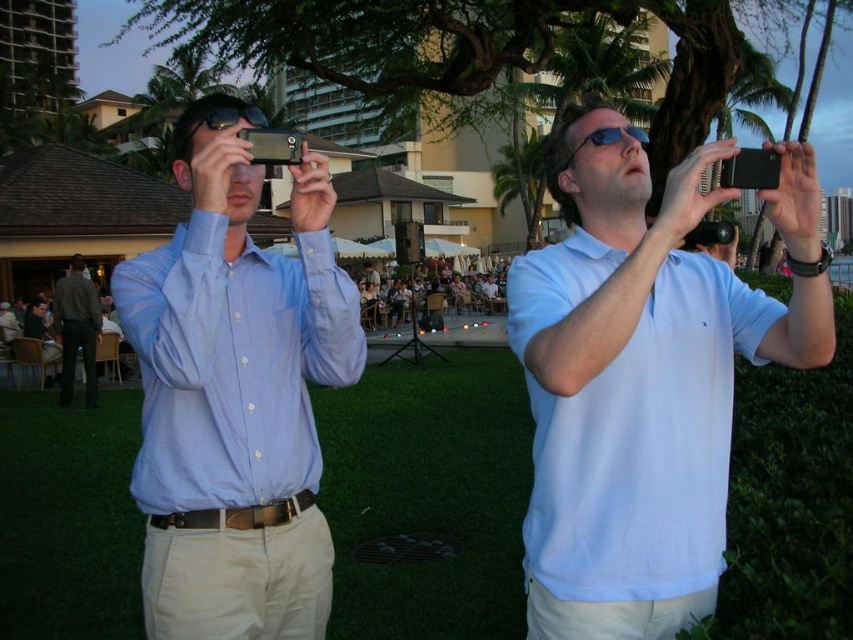
Is point (196, 440) positioned after point (61, 342)?

That is False.

Who is higher up, light blue button-down shirt at left or dark gray textured shirt at left?

light blue button-down shirt at left is higher up.

Is point (248, 365) farther from viewer compared to point (71, 307)?

That is False.

This screenshot has width=853, height=640. Find the location of `light blue button-down shirt at left`. light blue button-down shirt at left is located at coordinates (231, 364).

Which is below, light blue cotton polo shirt at upper right or light blue button-down shirt at left?

light blue cotton polo shirt at upper right is lower down.

Describe the element at coordinates (645, 445) in the screenshot. Image resolution: width=853 pixels, height=640 pixels. I see `light blue cotton polo shirt at upper right` at that location.

Which is behind, point (595, 412) or point (277, 400)?

The point (277, 400) is behind.

At what (x,y) coordinates should I click in order to perform the action: click on light blue cotton polo shirt at upper right. Please return your answer as a coordinate pair (x, y). This screenshot has width=853, height=640. Looking at the image, I should click on (645, 445).

Which is in front, point (577, 464) or point (93, 312)?

Point (577, 464) is in front.

Can you confirm if light blue cotton polo shirt at upper right is shorter than dark gray textured shirt at left?

Correct, light blue cotton polo shirt at upper right is not as tall as dark gray textured shirt at left.

Where is `light blue cotton polo shirt at upper right`? light blue cotton polo shirt at upper right is located at coordinates (645, 445).

You are a GUI agent. You are given a task and a screenshot of the screen. Output one action in this format:
    pyautogui.click(x=<x>, y=<y>)
    Task: Click on the light blue cotton polo shirt at upper right
    The image size is (853, 640).
    Given the screenshot: What is the action you would take?
    pyautogui.click(x=645, y=445)